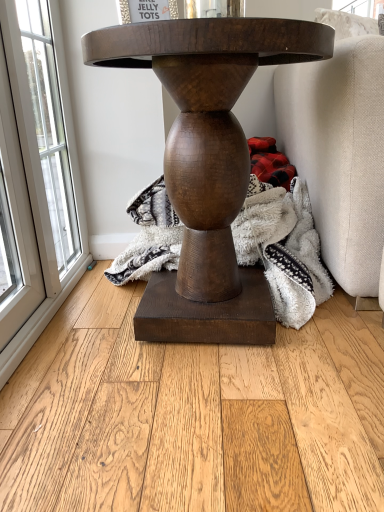
Question: Would you say natural wood flooring at center is part of red plaid fabric at lower right's contents?

Choices:
 (A) yes
 (B) no

Answer: (B)

Question: Is red plaid fabric at lower right aimed at natural wood flooring at center?

Choices:
 (A) yes
 (B) no

Answer: (A)

Question: From a real-world perspective, is red plaid fabric at lower right physically below natural wood flooring at center?

Choices:
 (A) yes
 (B) no

Answer: (B)

Question: Are red plaid fabric at lower right and natural wood flooring at center far apart?

Choices:
 (A) no
 (B) yes

Answer: (A)

Question: Does red plaid fabric at lower right have a lesser width compared to natural wood flooring at center?

Choices:
 (A) yes
 (B) no

Answer: (A)

Question: Does red plaid fabric at lower right have a lesser height compared to natural wood flooring at center?

Choices:
 (A) yes
 (B) no

Answer: (B)

Question: Can you confirm if matte brown wooden table at center is bigger than red plaid fabric at lower right?

Choices:
 (A) no
 (B) yes

Answer: (B)

Question: Does matte brown wooden table at center have a smaller size compared to red plaid fabric at lower right?

Choices:
 (A) no
 (B) yes

Answer: (A)

Question: Does matte brown wooden table at center have a greater height compared to red plaid fabric at lower right?

Choices:
 (A) yes
 (B) no

Answer: (A)

Question: From the image's perspective, is matte brown wooden table at center on red plaid fabric at lower right?

Choices:
 (A) no
 (B) yes

Answer: (A)

Question: From a real-world perspective, is matte brown wooden table at center under red plaid fabric at lower right?

Choices:
 (A) no
 (B) yes

Answer: (A)

Question: From a real-world perspective, is matte brown wooden table at center over red plaid fabric at lower right?

Choices:
 (A) yes
 (B) no

Answer: (A)

Question: Considering the relative sizes of fuzzy white blanket at center and red plaid fabric at lower right in the image provided, is fuzzy white blanket at center wider than red plaid fabric at lower right?

Choices:
 (A) yes
 (B) no

Answer: (A)